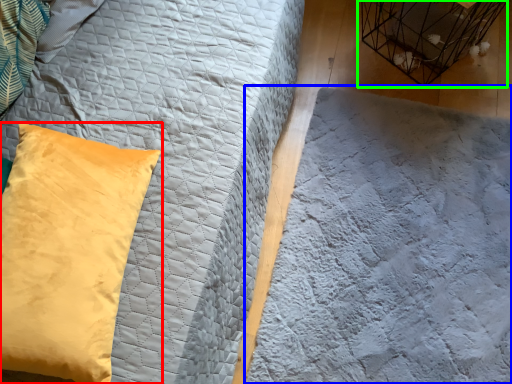
Question: Based on their relative distances, which object is farther from pillow (highlighted by a red box)? Choose from sheet (highlighted by a blue box) and bird cage (highlighted by a green box).

Choices:
 (A) sheet
 (B) bird cage

Answer: (B)